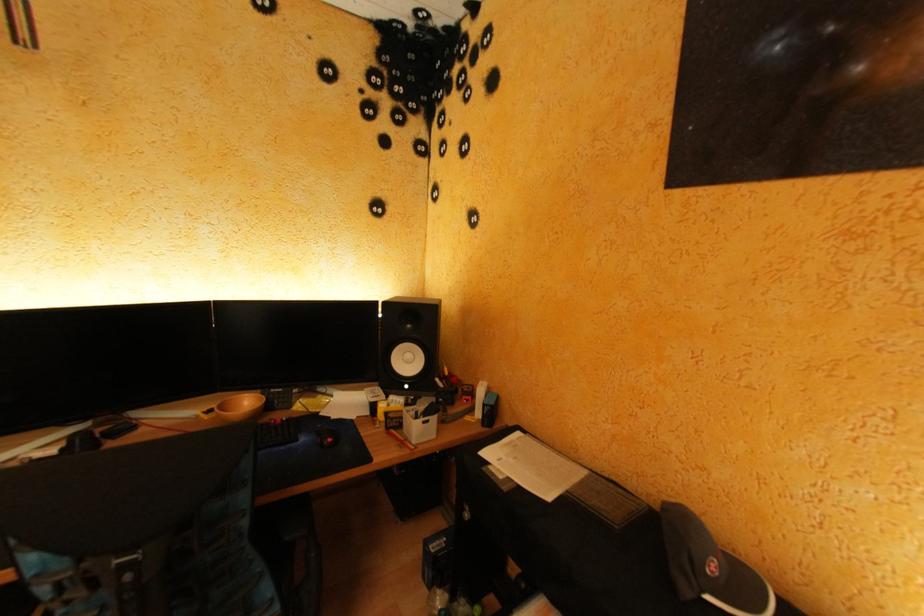
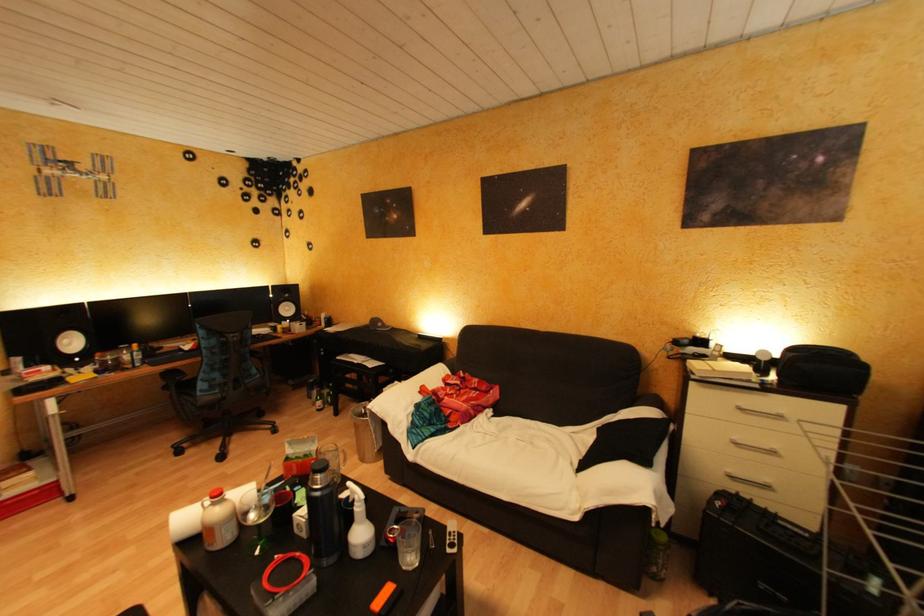
Question: Which direction would the cameraman need to move to produce the second image? Reply with the corresponding letter.

Choices:
 (A) Left
 (B) Right
 (C) Forward
 (D) Backward

Answer: (D)